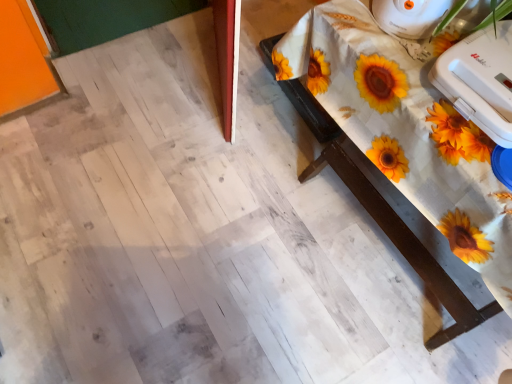
You are a GUI agent. You are given a task and a screenshot of the screen. Output one action in this format:
    pyautogui.click(x=<x>, y=<y>)
    Task: Click on the vacant area that lies between white plastic toaster at upper right, which is the second appliance from top to bottom, and white plastic iron at upper right, the 1th appliance positioned from the top
    Image resolution: width=512 pixels, height=384 pixels.
    Given the screenshot: What is the action you would take?
    pyautogui.click(x=415, y=52)